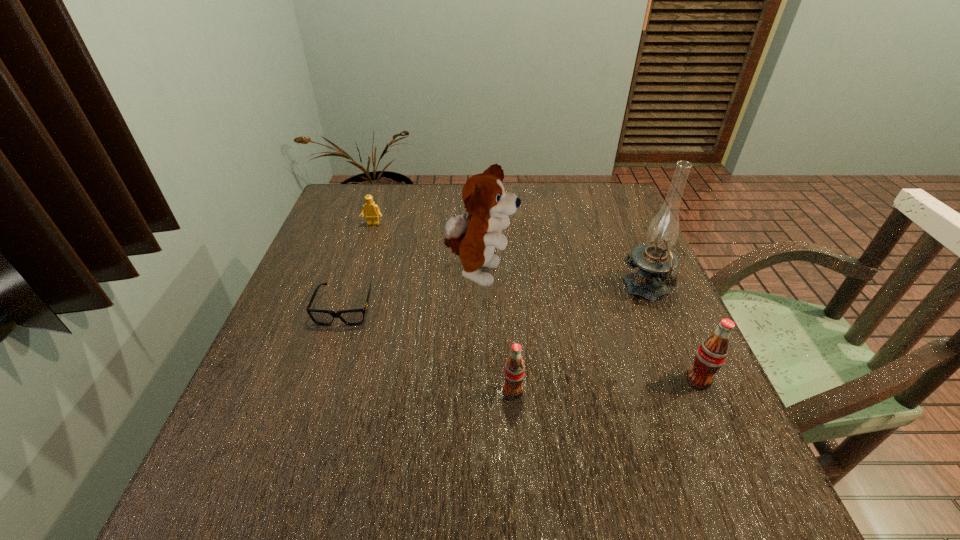
Where is `object situated at the far left corner`? This screenshot has width=960, height=540. object situated at the far left corner is located at coordinates (372, 212).

Where is `free spot at the far edge of the desktop`? The image size is (960, 540). free spot at the far edge of the desktop is located at coordinates (430, 192).

The height and width of the screenshot is (540, 960). In order to click on vacant space at the near edge of the desktop in this screenshot , I will do `click(604, 441)`.

Identify the location of vacant space at the left edge of the desktop. The image size is (960, 540). (348, 268).

In the image, there is a desktop. Find the location of `vacant space at the right edge`. vacant space at the right edge is located at coordinates (663, 300).

This screenshot has height=540, width=960. I want to click on vacant point at the far left corner, so click(x=335, y=205).

Locate an element on the screen. The width and height of the screenshot is (960, 540). empty space that is in between the oil lamp and the third shortest object is located at coordinates (580, 341).

Where is `empty location between the shortest object and the fourth tallest object`? The image size is (960, 540). empty location between the shortest object and the fourth tallest object is located at coordinates (429, 349).

The width and height of the screenshot is (960, 540). Identify the location of free space that is in between the fifth shortest object and the sunglasses. (412, 291).

Identify the location of free space between the oil lamp and the taller soda. The image size is (960, 540). (673, 335).